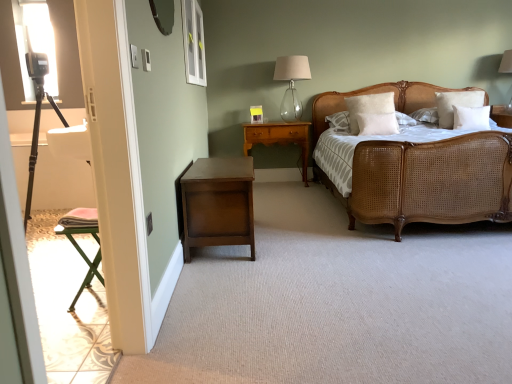
You are a GUI agent. You are given a task and a screenshot of the screen. Output one action in this format:
    pyautogui.click(x=<x>, y=<y>)
    Task: Click on the empty space that is to the right of dark wood nightstand at lower left, marked as the first nightstand in a front-to-back arrangement
    This screenshot has height=384, width=512.
    Given the screenshot: What is the action you would take?
    pyautogui.click(x=305, y=235)